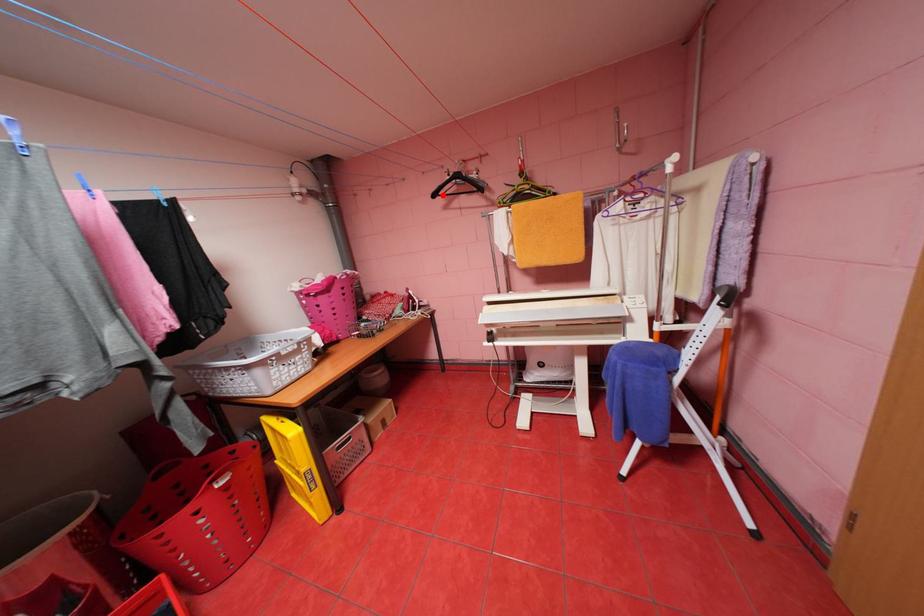
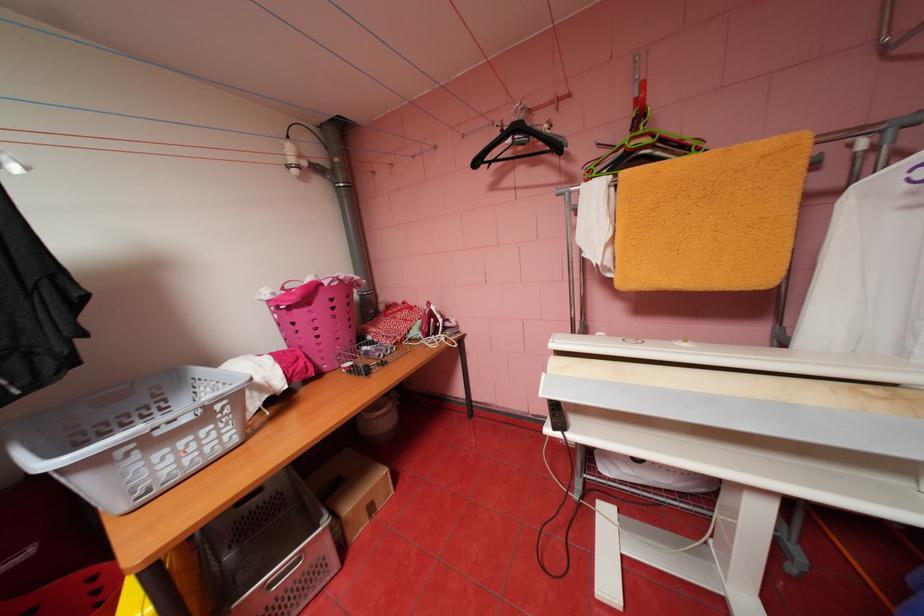
Locate, in the second image, the point that corresponds to the highlighted location in the first image.

(484, 163)